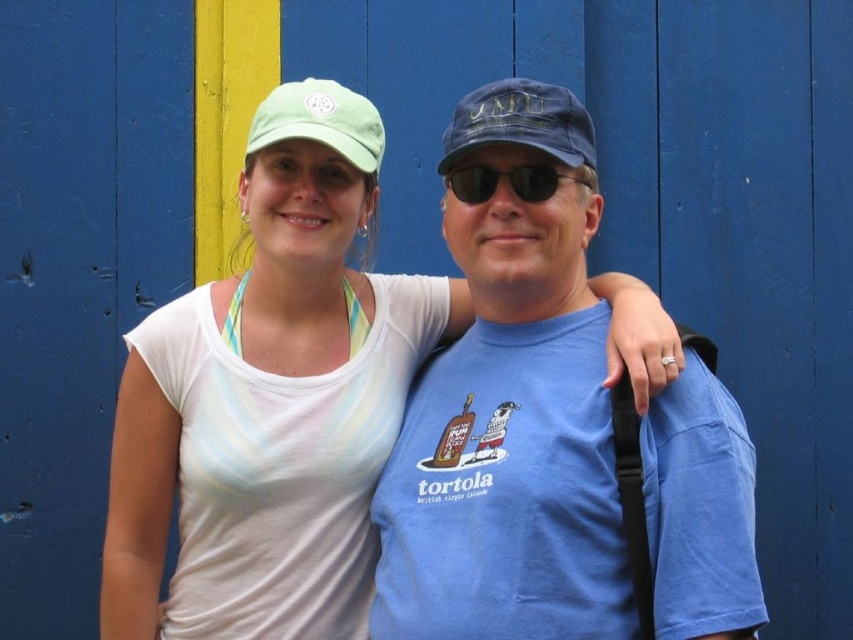
Question: Which object is the farthest from the white fabric tank top at center?

Choices:
 (A) sunglasses at center
 (B) blue cotton t-shirt at center
 (C) blue denim baseball cap at center
 (D) green fabric baseball cap at upper center

Answer: (C)

Question: Can you confirm if blue cotton t-shirt at center is bigger than blue denim baseball cap at center?

Choices:
 (A) yes
 (B) no

Answer: (A)

Question: Which point is closer to the camera?

Choices:
 (A) 561,138
 (B) 273,93
 (C) 316,496
 (D) 494,172

Answer: (A)

Question: Does blue denim baseball cap at center appear on the right side of green fabric baseball cap at upper center?

Choices:
 (A) no
 (B) yes

Answer: (B)

Question: Which point is farther from the camera taking this photo?

Choices:
 (A) (520, 177)
 (B) (492, 88)
 (C) (306, 115)
 (D) (436, 426)

Answer: (D)

Question: Does blue cotton t-shirt at center have a smaller size compared to white fabric tank top at center?

Choices:
 (A) yes
 (B) no

Answer: (B)